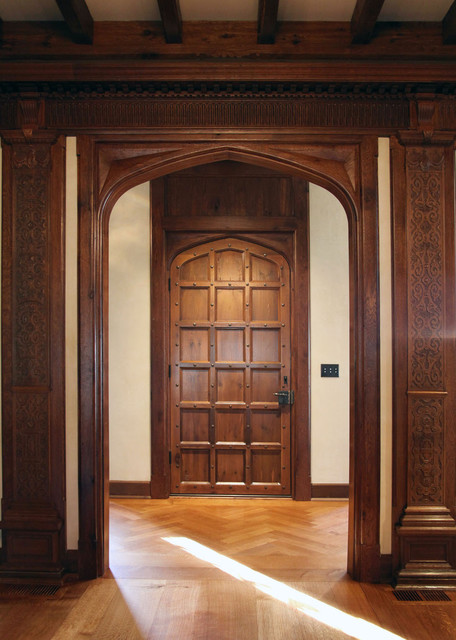
The image size is (456, 640). What are the coordinates of `wood boards` in the screenshot? It's located at (369, 22), (271, 13), (172, 29), (80, 20).